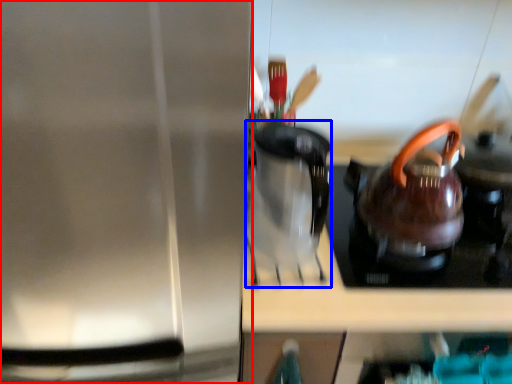
Question: Which object appears closest to the camera in this image, kitchen appliance (highlighted by a red box) or coffeepot (highlighted by a blue box)?

Choices:
 (A) kitchen appliance
 (B) coffeepot

Answer: (A)